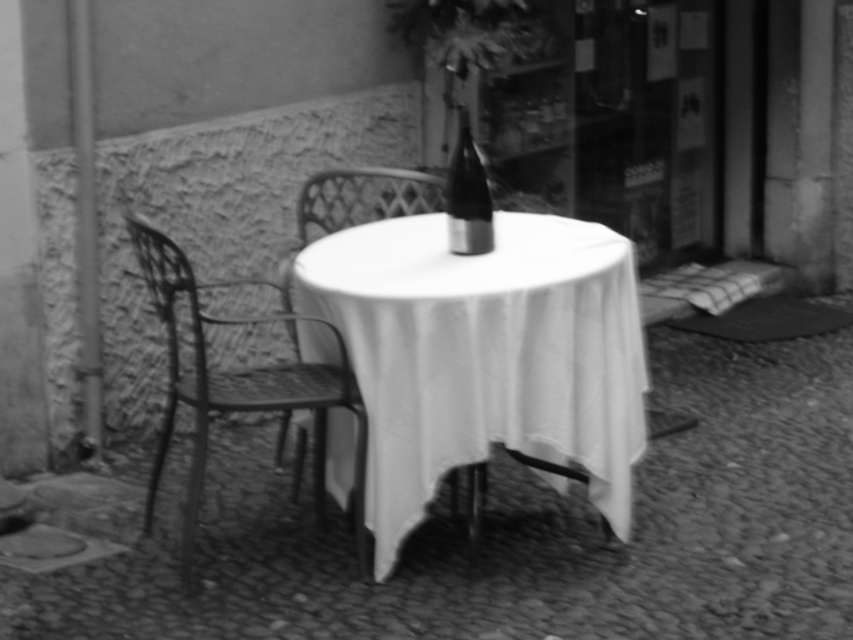
Question: Is white cloth-covered table at center bigger than metallic mesh chair at center?

Choices:
 (A) no
 (B) yes

Answer: (B)

Question: Which of these objects is positioned farthest from the white cloth-covered table at center?

Choices:
 (A) metallic mesh chair at center
 (B) metallic wire chair at left

Answer: (A)

Question: Where is white cloth-covered table at center located in relation to smooth glass bottle at center in the image?

Choices:
 (A) right
 (B) left

Answer: (A)

Question: Among these points, which one is nearest to the camera?

Choices:
 (A) (457, 236)
 (B) (320, 221)

Answer: (A)

Question: Can you confirm if metallic wire chair at left is positioned below metallic mesh chair at center?

Choices:
 (A) no
 (B) yes

Answer: (B)

Question: Which object is farther from the camera taking this photo?

Choices:
 (A) metallic mesh chair at center
 (B) metallic wire chair at left
 (C) white cloth-covered table at center

Answer: (A)